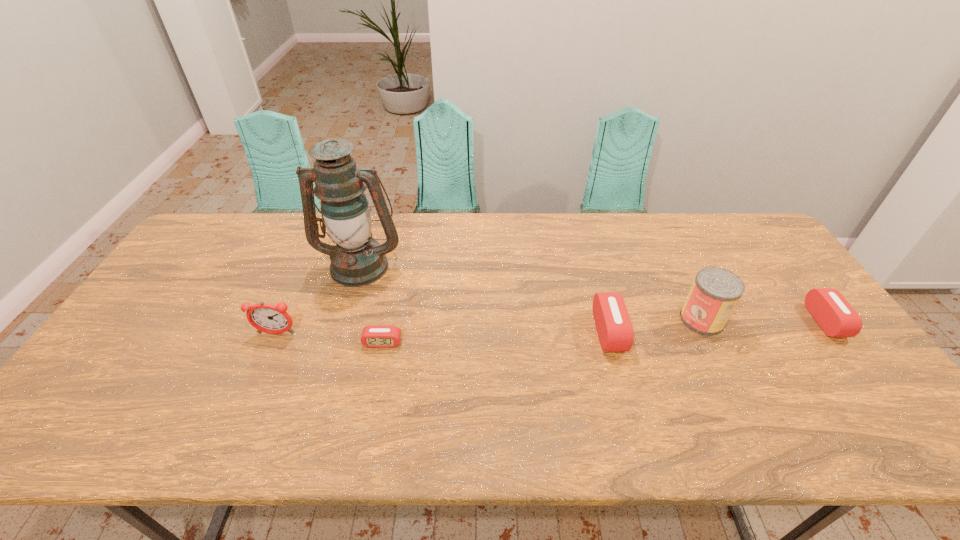
Please point a spot on the left to add another alarm clock. Please provide its 2D coordinates. Your answer should be formatted as a tuple, i.e. [(x, y)], where the tuple contains the x and y coordinates of a point satisfying the conditions above.

[(145, 354)]